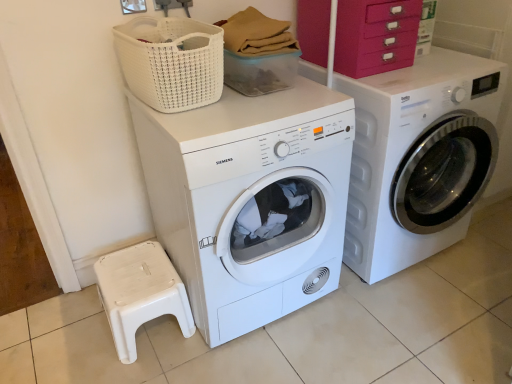
Locate an element on the screen. This screenshot has width=512, height=384. vacant space situated above white plastic step stool at lower left (from a real-world perspective) is located at coordinates (132, 278).